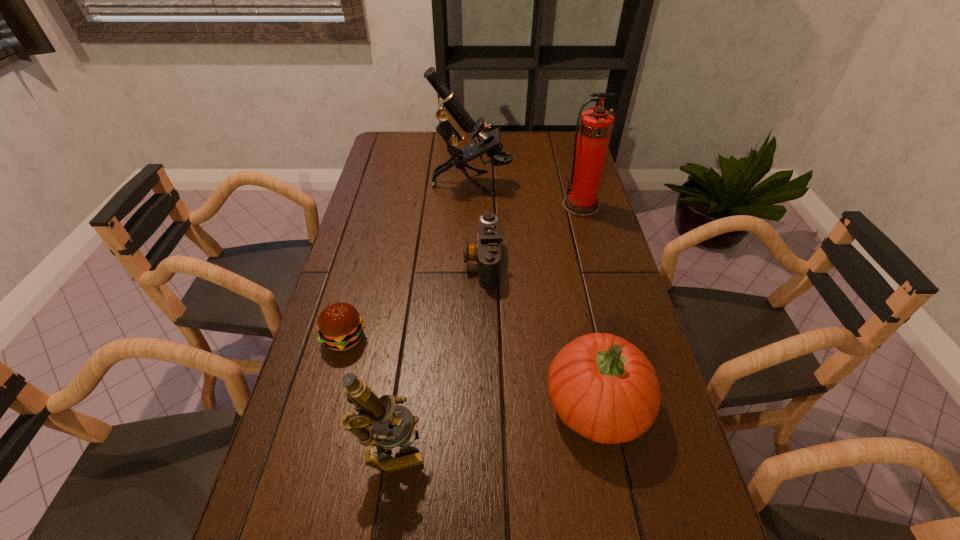
Identify which object is the fifth closest to the camera. Please provide its 2D coordinates. Your answer should be formatted as a tuple, i.e. [(x, y)], where the tuple contains the x and y coordinates of a point satisfying the conditions above.

[(375, 413)]

Locate an element on the screen. free location that satisfies the following two spatial constraints: 1. at the discharge end of the fire extinguisher; 2. on the lens of the camera is located at coordinates (596, 261).

This screenshot has width=960, height=540. In order to click on free space that satisfies the following two spatial constraints: 1. on the lens of the camera; 2. on the back side of the third shortest object in this screenshot , I will do coord(484,403).